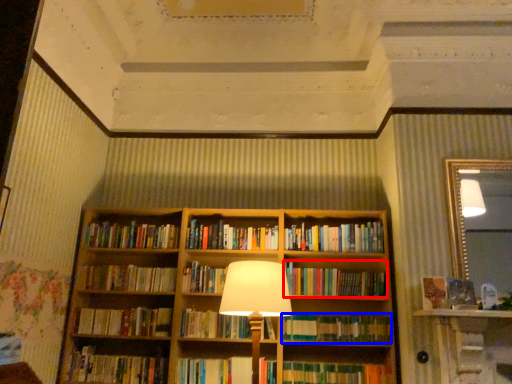
Question: Among these objects, which one is farthest to the camera, book (highlighted by a red box) or book (highlighted by a blue box)?

Choices:
 (A) book
 (B) book

Answer: (A)